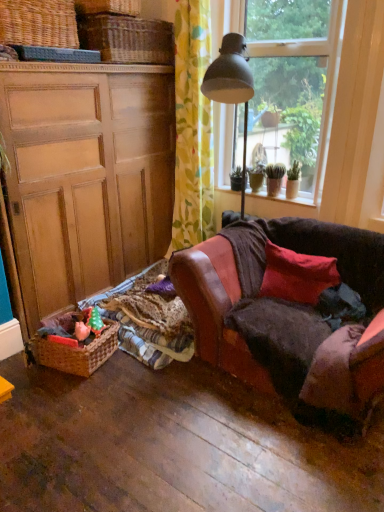
Question: From a real-world perspective, is woven wicker basket at upper left, positioned as the first basket in front-to-back order, above or below floral fabric curtain at upper center?

Choices:
 (A) below
 (B) above

Answer: (B)

Question: In the image, is woven wicker basket at upper left, arranged as the second basket when viewed from the back, positioned in front of or behind floral fabric curtain at upper center?

Choices:
 (A) front
 (B) behind

Answer: (A)

Question: Considering the real-world distances, which object is farthest from the woven brown picnic basket at upper left, the 1th picnic basket positioned from the top?

Choices:
 (A) woven brown picnic basket at lower left, placed as the 2th picnic basket when sorted from top to bottom
 (B) matte wood cabinet at left
 (C) smooth concrete window sill at center
 (D) floral fabric curtain at upper center
 (E) plaid fabric blanket at lower left

Answer: (A)

Question: Which of these objects is positioned farthest from the woven brown picnic basket at upper left, the 1th picnic basket positioned from the top?

Choices:
 (A) woven brown basket at upper left, which is counted as the first basket, starting from the back
 (B) green matte plant at window, positioned as the second houseplant in left-to-right order
 (C) woven brown picnic basket at lower left, placed as the 2th picnic basket when sorted from top to bottom
 (D) woven wicker basket at upper left, positioned as the first basket in front-to-back order
 (E) green matte plant at window, the second houseplant viewed from the right

Answer: (B)